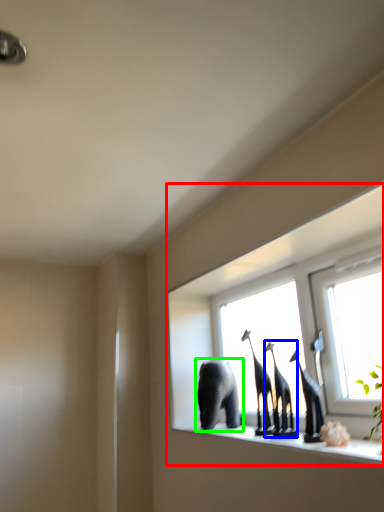
Question: Which object is positioned farthest from window (highlighted by a red box)? Select from animal (highlighted by a blue box) and elephant (highlighted by a green box).

Choices:
 (A) animal
 (B) elephant

Answer: (A)